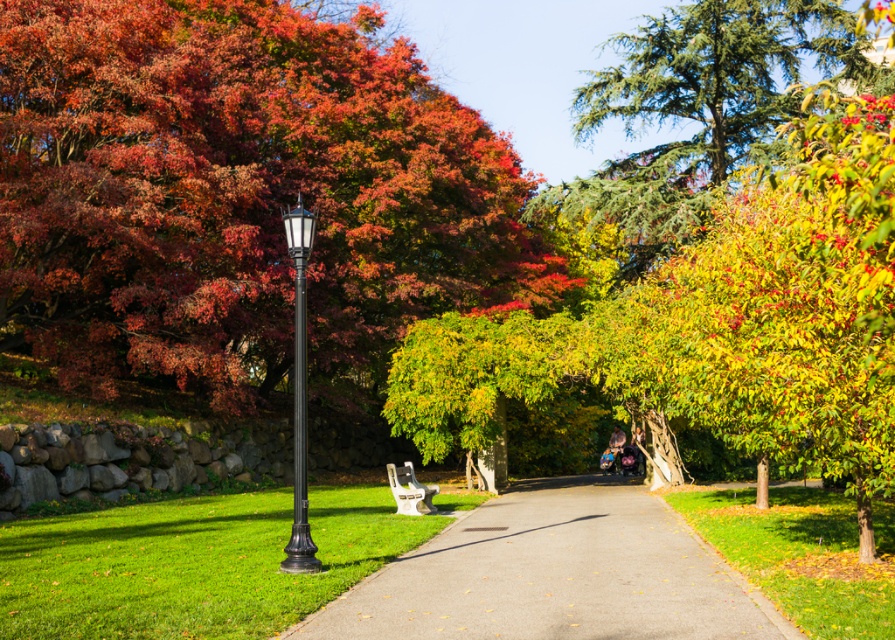
You are a park visitor who wants to take a photo of the autumn leaves at upper left and the black metal lamp post at left. Which object is located higher in the image?

The autumn leaves at upper left are positioned over the black metal lamp post at left, so they are higher in the image.